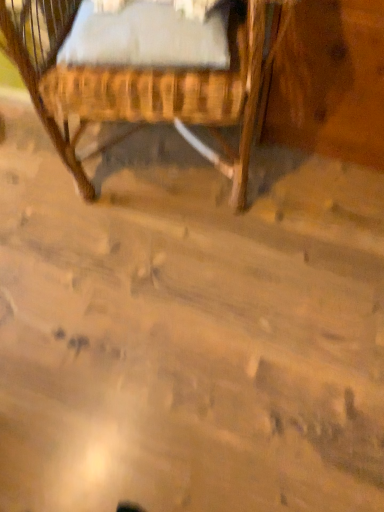
Identify the location of blank space situated above white soft fabric at upper center (from a real-world perspective). click(x=169, y=13).